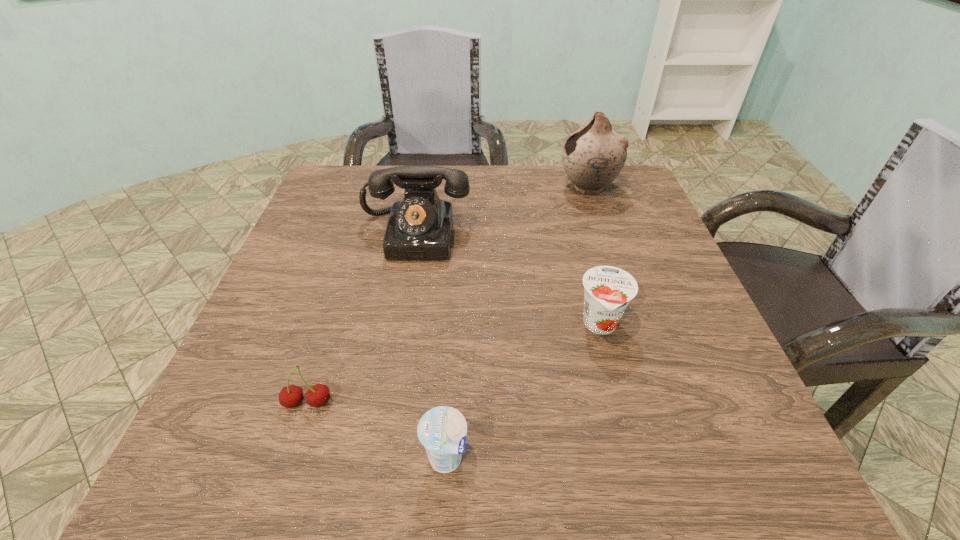
Locate an element on the screen. The width and height of the screenshot is (960, 540). vacant area that lies between the shortest object and the third nearest object is located at coordinates (523, 392).

Choose which object is the third nearest neighbor to the third farthest object. Please provide its 2D coordinates. Your answer should be formatted as a tuple, i.e. [(x, y)], where the tuple contains the x and y coordinates of a point satisfying the conditions above.

[(593, 156)]

You are a GUI agent. You are given a task and a screenshot of the screen. Output one action in this format:
    pyautogui.click(x=<x>, y=<y>)
    Task: Click on the object that is the closest one to the shorter yogurt
    
    Given the screenshot: What is the action you would take?
    tap(291, 396)

In order to click on free location that satisfies the following two spatial constraints: 1. from the spout of the tallest object; 2. on the dial of the fourth nearest object in this screenshot , I will do `click(604, 235)`.

Identify the location of vacant area that satisfies the following two spatial constraints: 1. on the dial of the telephone; 2. on the right side of the right yogurt. This screenshot has height=540, width=960. (399, 325).